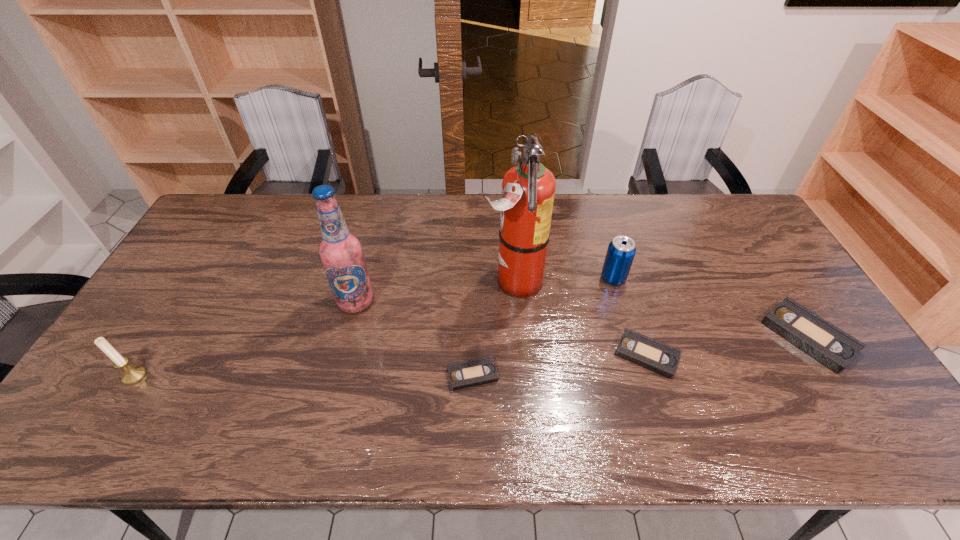
Given the evenly spaced videotapes in the image, where should an extra videotape be added on the left to preserve the spacing? Please point to a vacant space. Please provide its 2D coordinates. Your answer should be formatted as a tuple, i.e. [(x, y)], where the tuple contains the x and y coordinates of a point satisfying the conditions above.

[(285, 396)]